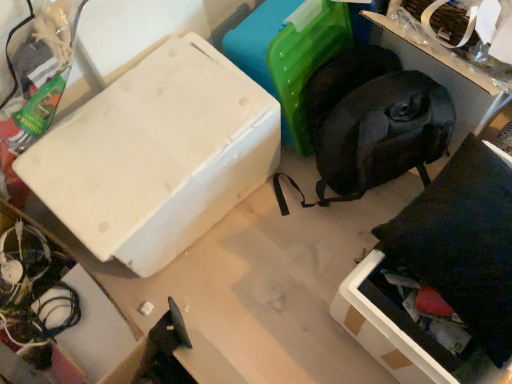
This screenshot has height=384, width=512. I want to click on free space above white matte box at upper left (from a real-world perspective), so click(x=141, y=132).